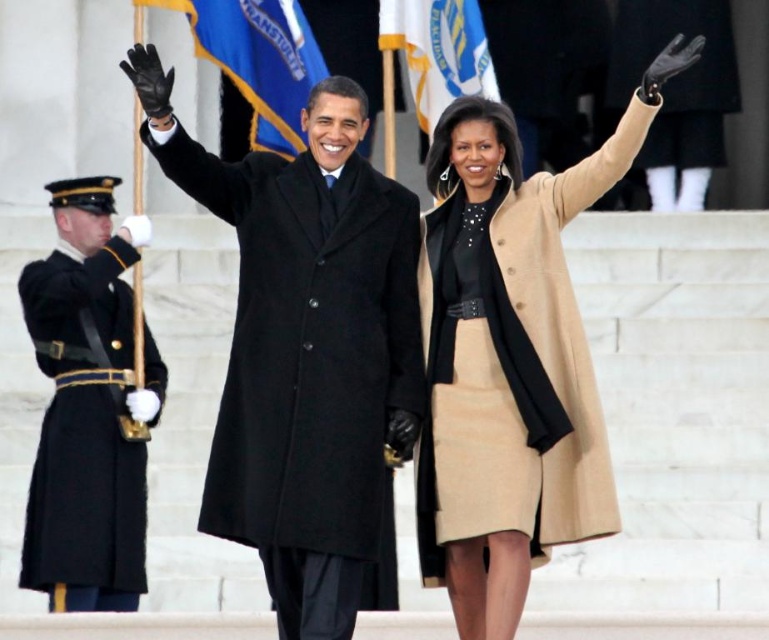
Does beige wool coat at center have a greater width compared to blue fabric flag at upper center?

Indeed, beige wool coat at center has a greater width compared to blue fabric flag at upper center.

Identify the location of beige wool coat at center. (511, 358).

Locate an element on the screen. Image resolution: width=769 pixels, height=640 pixels. beige wool coat at center is located at coordinates (511, 358).

Is beige wool coat at center above black wool uniform at left?

Yes, beige wool coat at center is above black wool uniform at left.

Which is behind, point (554, 330) or point (145, 362)?

The point (145, 362) is more distant.

Is point (448, 554) less distant than point (108, 429)?

Yes, it is.

Where is `beige wool coat at center`? Image resolution: width=769 pixels, height=640 pixels. beige wool coat at center is located at coordinates (511, 358).

Can you confirm if black wool coat at center is positioned above beige wool coat at center?

No, black wool coat at center is not above beige wool coat at center.

Does black wool coat at center have a larger size compared to beige wool coat at center?

No.

Is point (348, 141) in front of point (445, 449)?

No.

Image resolution: width=769 pixels, height=640 pixels. I want to click on black wool coat at center, so click(305, 346).